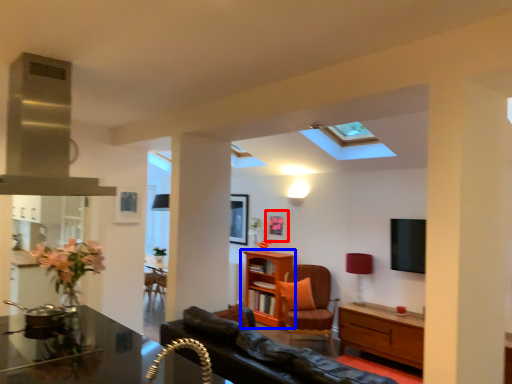
Question: Which object appears farthest to the camera in this image, picture frame (highlighted by a red box) or shelf (highlighted by a blue box)?

Choices:
 (A) picture frame
 (B) shelf

Answer: (A)